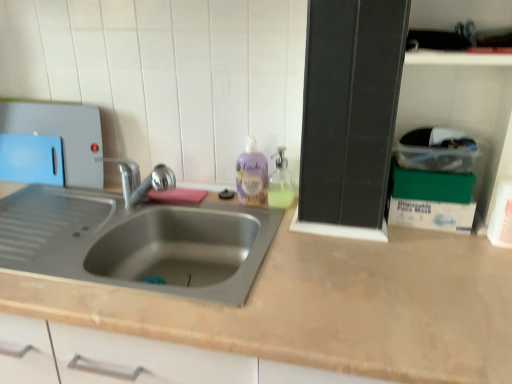
Question: Does green cardboard box at right, which appears as the third box when viewed from the top, lie in front of purple translucent liquid soap at center?

Choices:
 (A) yes
 (B) no

Answer: (A)

Question: From the image's perspective, is green cardboard box at right, which appears as the 1th box when ordered from the bottom, located beneath purple translucent liquid soap at center?

Choices:
 (A) no
 (B) yes

Answer: (B)

Question: Is green cardboard box at right, which appears as the 1th box when ordered from the bottom, further to camera compared to purple translucent liquid soap at center?

Choices:
 (A) no
 (B) yes

Answer: (A)

Question: Is green cardboard box at right, which appears as the third box when viewed from the top, not within purple translucent liquid soap at center?

Choices:
 (A) no
 (B) yes

Answer: (B)

Question: Is green cardboard box at right, which appears as the 1th box when ordered from the bottom, placed right next to purple translucent liquid soap at center?

Choices:
 (A) no
 (B) yes

Answer: (A)

Question: Does green cardboard box at right, which appears as the 1th box when ordered from the bottom, have a greater height compared to purple translucent liquid soap at center?

Choices:
 (A) yes
 (B) no

Answer: (B)

Question: Does translucent plastic soap dispenser at upper right appear on the right side of purple translucent liquid soap at center?

Choices:
 (A) no
 (B) yes

Answer: (B)

Question: Is translucent plastic soap dispenser at upper right taller than purple translucent liquid soap at center?

Choices:
 (A) no
 (B) yes

Answer: (A)

Question: Is translucent plastic soap dispenser at upper right located outside purple translucent liquid soap at center?

Choices:
 (A) yes
 (B) no

Answer: (A)

Question: Can you confirm if translucent plastic soap dispenser at upper right is shorter than purple translucent liquid soap at center?

Choices:
 (A) no
 (B) yes

Answer: (B)

Question: Can you confirm if translucent plastic soap dispenser at upper right is bigger than purple translucent liquid soap at center?

Choices:
 (A) no
 (B) yes

Answer: (B)

Question: Considering the relative sizes of translucent plastic soap dispenser at upper right and purple translucent liquid soap at center in the image provided, is translucent plastic soap dispenser at upper right wider than purple translucent liquid soap at center?

Choices:
 (A) yes
 (B) no

Answer: (A)

Question: Does blue plastic cutting board at left have a lesser width compared to translucent plastic soap dispenser at upper right?

Choices:
 (A) yes
 (B) no

Answer: (A)